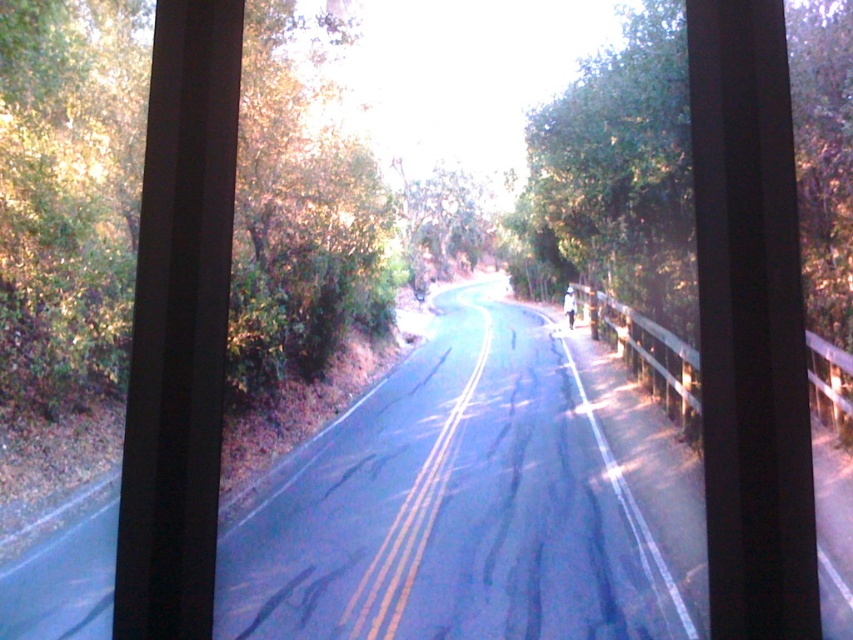
Where is `green leafy tree at upper left`? green leafy tree at upper left is located at coordinates (300, 208).

Based on the photo, between green leafy tree at upper left and green leafy tree at center, which one is positioned higher?

green leafy tree at center

Is point (340, 269) closer to camera compared to point (474, 180)?

Yes, point (340, 269) is closer to viewer.

Locate an element on the screen. green leafy tree at upper left is located at coordinates (300, 208).

Is green leafy tree at right above green leafy tree at upper left?

No.

Who is more distant from viewer, (813, 310) or (315, 129)?

Positioned behind is point (315, 129).

This screenshot has width=853, height=640. What are the coordinates of `green leafy tree at right` in the screenshot? It's located at (616, 173).

Between green leafy tree at right and green leafy tree at center, which one appears on the left side from the viewer's perspective?

Positioned to the left is green leafy tree at center.

Which is behind, point (556, 246) or point (410, 268)?

The point (410, 268) is more distant.

Is point (840, 108) more distant than point (409, 230)?

No, (840, 108) is in front of (409, 230).

You are a GUI agent. You are given a task and a screenshot of the screen. Output one action in this format:
    pyautogui.click(x=<x>, y=<y>)
    Task: Click on the green leafy tree at right
    Image resolution: width=853 pixels, height=640 pixels.
    Given the screenshot: What is the action you would take?
    pyautogui.click(x=616, y=173)